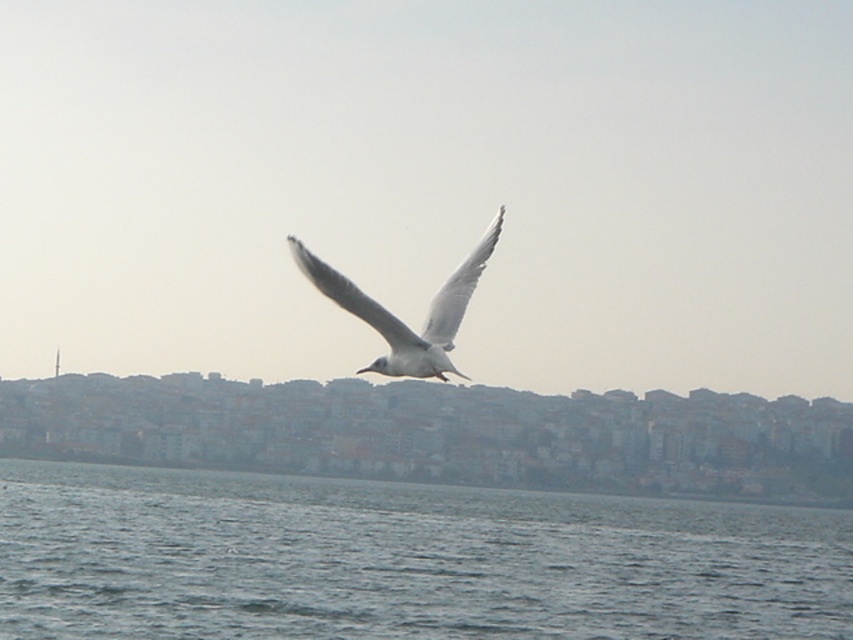
Consider the image. Can you confirm if gray water at lower center is positioned below white feathered bird at center?

Yes, gray water at lower center is below white feathered bird at center.

Who is shorter, gray water at lower center or white feathered bird at center?

gray water at lower center is shorter.

Locate an element on the screen. This screenshot has height=640, width=853. gray water at lower center is located at coordinates (402, 561).